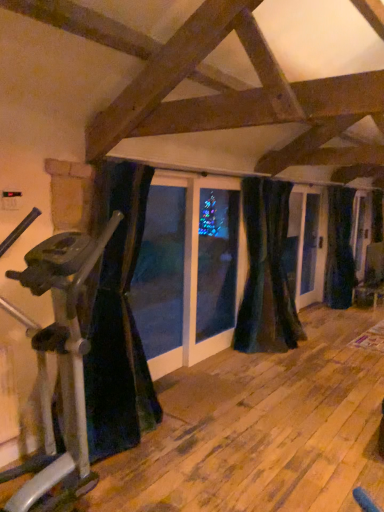
Question: Is silver metallic stationary bicycle at left oriented away from velvet dark blue curtain at center, which is the 2th curtain from back to front?

Choices:
 (A) yes
 (B) no

Answer: (B)

Question: From the image's perspective, is silver metallic stationary bicycle at left below velvet dark blue curtain at center, which is the 2th curtain from back to front?

Choices:
 (A) no
 (B) yes

Answer: (B)

Question: From a real-world perspective, is silver metallic stationary bicycle at left beneath velvet dark blue curtain at center, which is the 2th curtain from back to front?

Choices:
 (A) no
 (B) yes

Answer: (B)

Question: Considering the relative positions of silver metallic stationary bicycle at left and velvet dark blue curtain at center, which appears as the 2th curtain when viewed from the left, in the image provided, is silver metallic stationary bicycle at left in front of velvet dark blue curtain at center, which appears as the 2th curtain when viewed from the left,?

Choices:
 (A) no
 (B) yes

Answer: (B)

Question: Is silver metallic stationary bicycle at left facing towards velvet dark blue curtain at center, which appears as the second curtain when viewed from the right?

Choices:
 (A) no
 (B) yes

Answer: (A)

Question: Is silver metallic stationary bicycle at left not near velvet dark blue curtain at center, which appears as the second curtain when viewed from the right?

Choices:
 (A) yes
 (B) no

Answer: (A)

Question: Is black velvet curtain at left, the first curtain when ordered from left to right, smaller than silver metallic stationary bicycle at left?

Choices:
 (A) yes
 (B) no

Answer: (B)

Question: Is black velvet curtain at left, positioned as the third curtain in right-to-left order, not close to silver metallic stationary bicycle at left?

Choices:
 (A) yes
 (B) no

Answer: (B)

Question: Is black velvet curtain at left, arranged as the first curtain when viewed from the front, facing towards silver metallic stationary bicycle at left?

Choices:
 (A) no
 (B) yes

Answer: (A)

Question: Are black velvet curtain at left, arranged as the first curtain when viewed from the front, and silver metallic stationary bicycle at left beside each other?

Choices:
 (A) no
 (B) yes

Answer: (A)

Question: From the image's perspective, does black velvet curtain at left, the first curtain when ordered from left to right, appear higher than silver metallic stationary bicycle at left?

Choices:
 (A) yes
 (B) no

Answer: (A)

Question: From a real-world perspective, is black velvet curtain at left, the first curtain when ordered from left to right, physically below silver metallic stationary bicycle at left?

Choices:
 (A) no
 (B) yes

Answer: (A)

Question: Is black velvet curtain at left, which appears as the 3th curtain when viewed from the back, in front of dark blue velvet curtain at right, the first curtain viewed from the right?

Choices:
 (A) yes
 (B) no

Answer: (A)